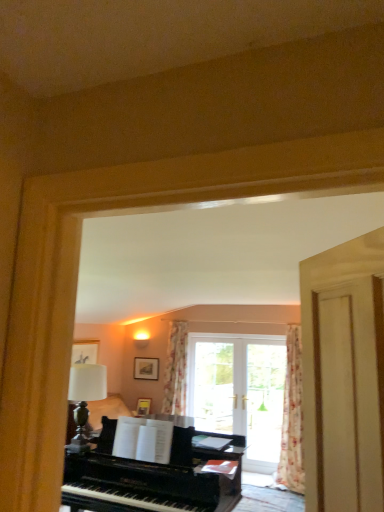
Question: From the image's perspective, would you say floral fabric curtain at center, marked as the 2th curtain in a right-to-left arrangement, is shown under matte black picture frame at center, the first picture frame positioned from the top?

Choices:
 (A) yes
 (B) no

Answer: (B)

Question: Is floral fabric curtain at center, the 1th curtain when ordered from back to front, positioned behind matte black picture frame at center, the first picture frame positioned from the top?

Choices:
 (A) yes
 (B) no

Answer: (B)

Question: Can you confirm if floral fabric curtain at center, marked as the 2th curtain in a right-to-left arrangement, is bigger than matte black picture frame at center, acting as the second picture frame starting from the bottom?

Choices:
 (A) no
 (B) yes

Answer: (B)

Question: Does floral fabric curtain at center, the 1th curtain when ordered from back to front, have a smaller size compared to matte black picture frame at center, positioned as the 2th picture frame in front-to-back order?

Choices:
 (A) yes
 (B) no

Answer: (B)

Question: Can you confirm if floral fabric curtain at center, the second curtain positioned from the front, is wider than matte black picture frame at center, acting as the second picture frame starting from the bottom?

Choices:
 (A) no
 (B) yes

Answer: (B)

Question: From a real-world perspective, relative to transparent glass door at center, is matte black picture frame at center, placed as the first picture frame when sorted from back to front, vertically above or below?

Choices:
 (A) above
 (B) below

Answer: (A)

Question: Do you think matte black picture frame at center, the first picture frame positioned from the top, is within transparent glass door at center, or outside of it?

Choices:
 (A) outside
 (B) inside

Answer: (A)

Question: Is matte black picture frame at center, positioned as the 2th picture frame in front-to-back order, to the left or to the right of transparent glass door at center in the image?

Choices:
 (A) left
 (B) right

Answer: (A)

Question: Considering the positions of matte black picture frame at center, the first picture frame positioned from the top, and transparent glass door at center in the image, is matte black picture frame at center, the first picture frame positioned from the top, wider or thinner than transparent glass door at center?

Choices:
 (A) thin
 (B) wide

Answer: (A)

Question: Is floral fabric curtain at right, the 1th curtain viewed from the right, inside the boundaries of transparent glass door at center, or outside?

Choices:
 (A) outside
 (B) inside

Answer: (A)

Question: From the image's perspective, is floral fabric curtain at right, the 1th curtain viewed from the right, located above or below transparent glass door at center?

Choices:
 (A) below
 (B) above

Answer: (B)

Question: Is point (291, 429) positioned closer to the camera than point (273, 437)?

Choices:
 (A) closer
 (B) farther

Answer: (A)

Question: From their relative heights in the image, would you say floral fabric curtain at right, the 1th curtain viewed from the right, is taller or shorter than transparent glass door at center?

Choices:
 (A) short
 (B) tall

Answer: (B)

Question: Is floral fabric curtain at center, the second curtain positioned from the front, bigger or smaller than floral fabric curtain at right, the 1th curtain in the front-to-back sequence?

Choices:
 (A) small
 (B) big

Answer: (A)

Question: Is floral fabric curtain at center, the second curtain positioned from the front, inside the boundaries of floral fabric curtain at right, which is the second curtain from left to right, or outside?

Choices:
 (A) inside
 (B) outside

Answer: (B)